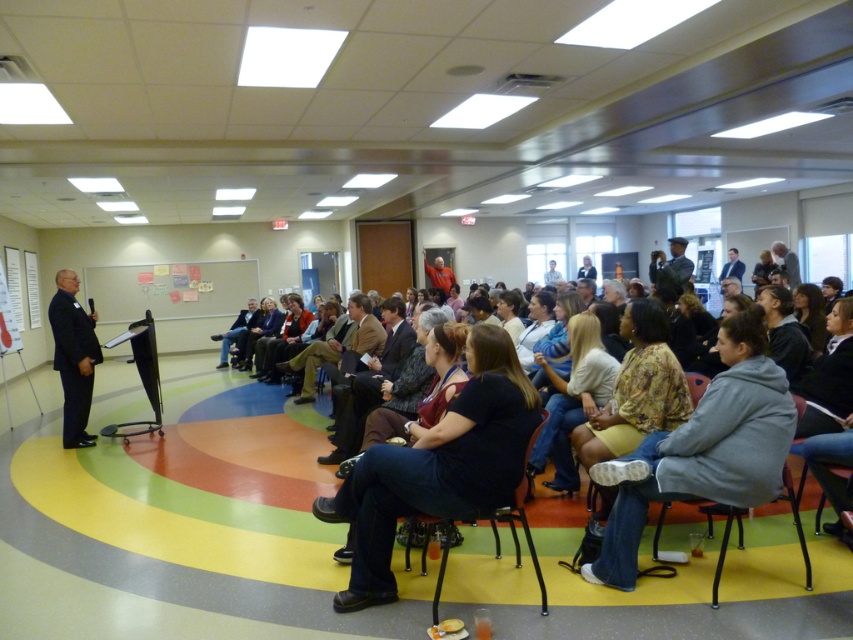
You are attending a formal event and need to find a seat. You see a gray fabric chair at lower right and a light brown suit at center. Which object is closer to the front of the room?

The gray fabric chair at lower right is closer to the front of the room because it is in front of the light brown suit at center.

You are an attendee at this event and want to take a photo of the speaker. There are two light brown items in your viewfinder, the light brown fabric shirt at center and the light brown suit at center. Which one should you focus on to capture the speaker clearly?

The light brown fabric shirt at center is closer to the viewer than the light brown suit at center, so focusing on the light brown fabric shirt at center will ensure the speaker is in focus.

You are attending a formal indoor event and notice a point of interest at coordinates point (572, 401). What object is located at this point?

The light brown fabric shirt at center is located at point (572, 401).